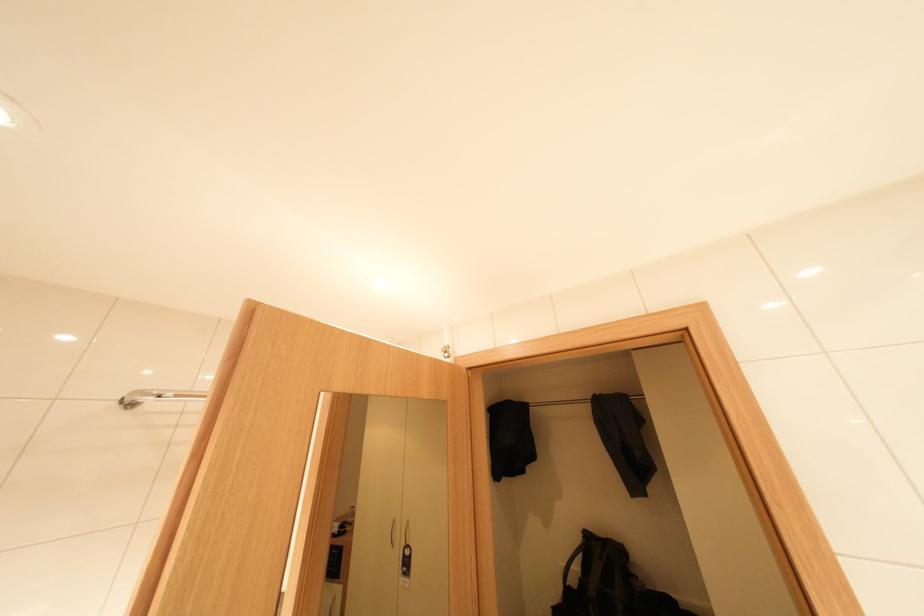
The location [157,397] corresponds to which object?

It refers to a metal towel rack.